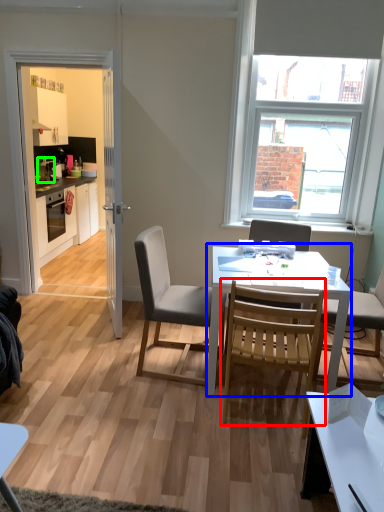
Question: Which is nearer to the chair (highlighted by a red box)? round table (highlighted by a blue box) or appliance (highlighted by a green box).

Choices:
 (A) round table
 (B) appliance

Answer: (A)